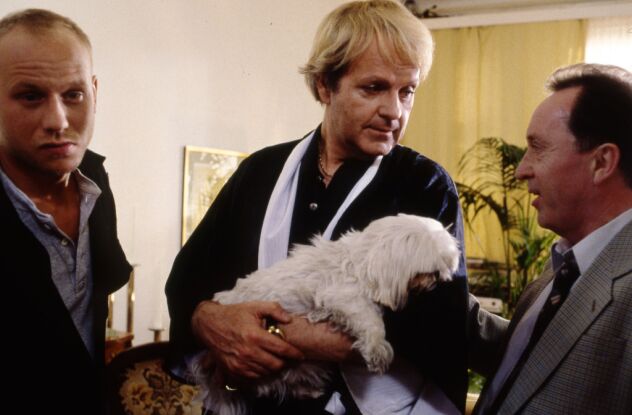
Identify the location of wall. This screenshot has height=415, width=632. (183, 55).